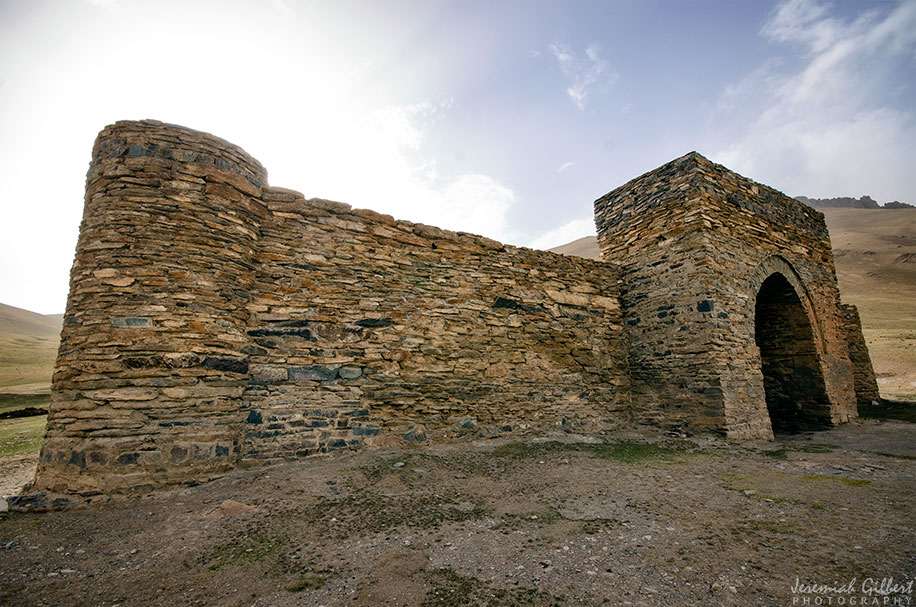
The image size is (916, 607). I want to click on doorway, so click(802, 413).